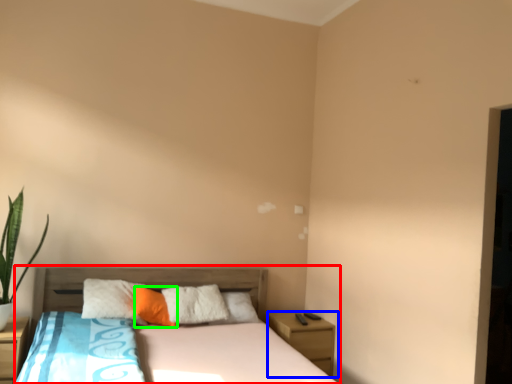
Question: Which is nearer to the bed (highlighted by a red box)? nightstand (highlighted by a blue box) or pillow (highlighted by a green box).

Choices:
 (A) nightstand
 (B) pillow

Answer: (B)